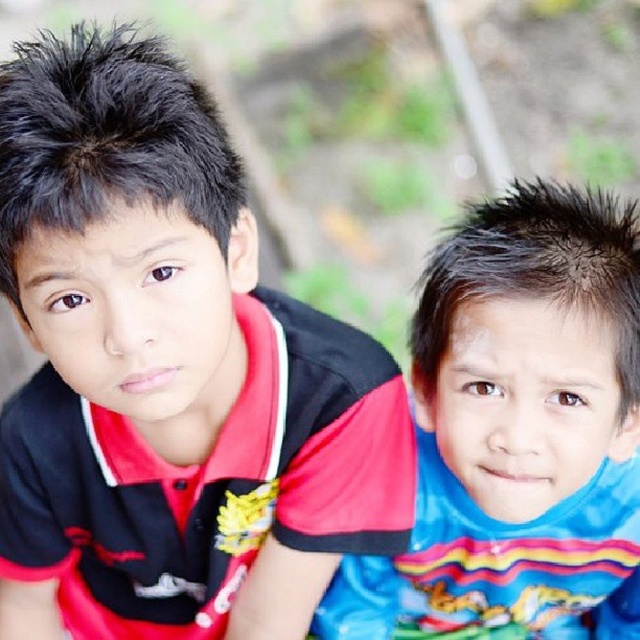
You are a photographer adjusting your camera to focus on two specific points in the image. The first point is at coordinates point (74, 179) and the second is at point (573, 196). Which point should you focus on first if you want to ensure the closest object is in sharp focus?

Point (74, 179) is closer to the camera than point (573, 196), so you should focus on point (74, 179) first to ensure the closest object is in sharp focus.

You are a photographer trying to capture both the red matte shirt at upper left and the blue shiny shirt at center in a single frame. Based on their positions and sizes, which shirt should you focus on first to ensure both are in focus?

The red matte shirt at upper left has a greater height compared to the blue shiny shirt at center, so focusing on the taller red matte shirt at upper left first will help ensure both are in focus as it is likely closer to the camera.